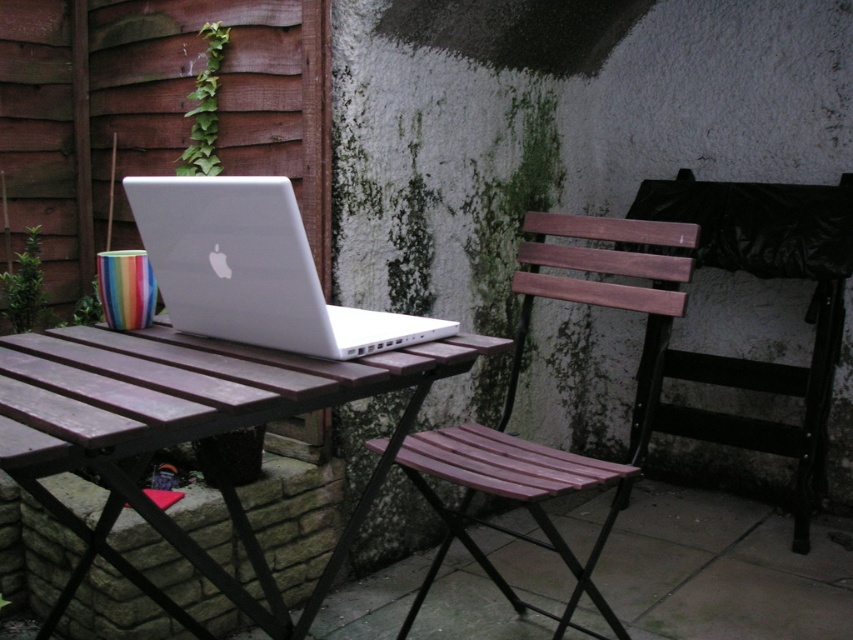
Question: In this image, where is wooden table at center located relative to sleek silver laptop at center?

Choices:
 (A) above
 (B) below

Answer: (B)

Question: Which object is farther from the camera taking this photo?

Choices:
 (A) wooden slats chair at center
 (B) wooden chair at right
 (C) pink wood stool at center
 (D) wooden table at center

Answer: (B)

Question: Does wooden chair at right have a larger size compared to sleek silver laptop at center?

Choices:
 (A) no
 (B) yes

Answer: (B)

Question: Among these points, which one is nearest to the camera?

Choices:
 (A) (820, 200)
 (B) (549, 493)
 (C) (68, 417)
 (D) (511, 532)

Answer: (C)

Question: Does wooden table at center appear under sleek silver laptop at center?

Choices:
 (A) no
 (B) yes

Answer: (B)

Question: Which point is closer to the camera?

Choices:
 (A) 149,580
 (B) 804,248

Answer: (A)